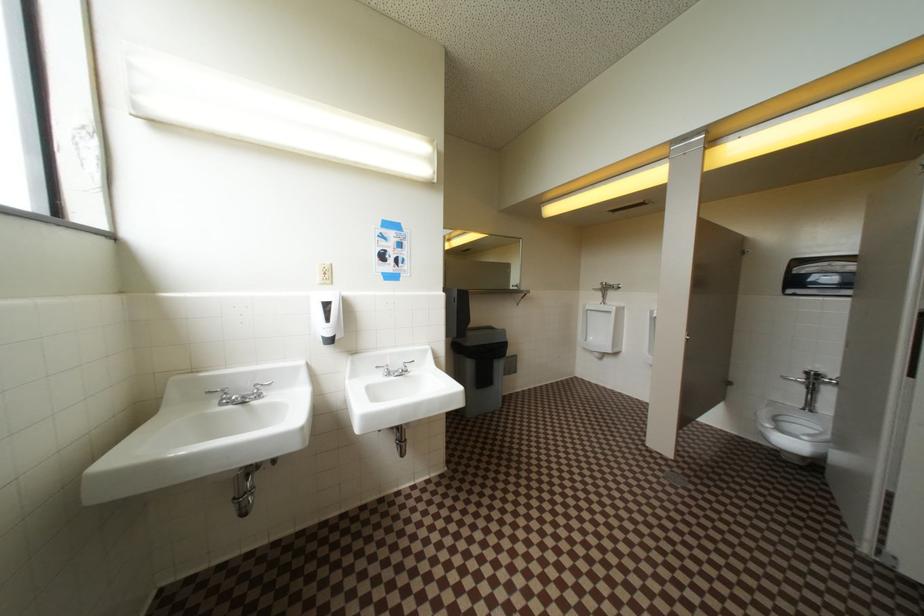
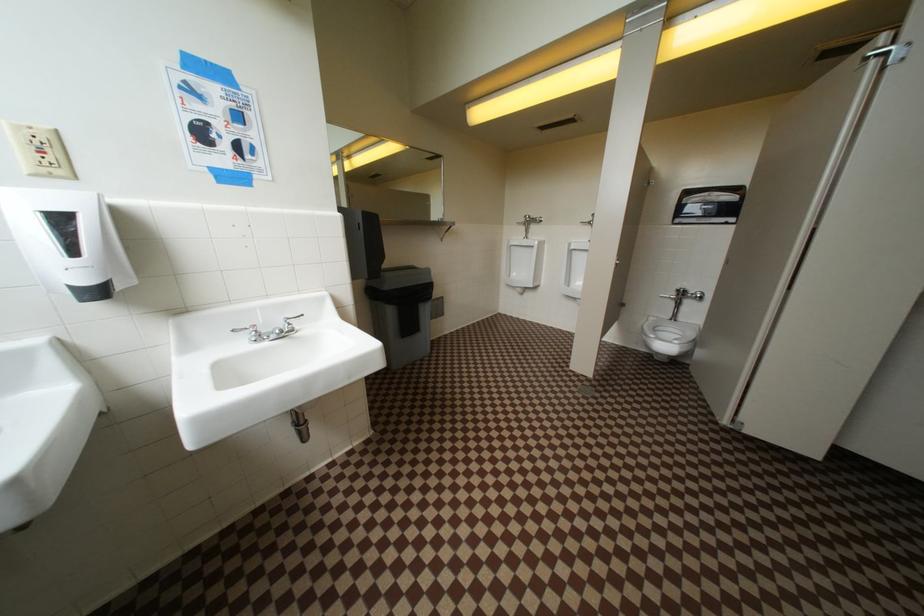
Question: The images are taken continuously from a first-person perspective. In which direction are you moving?

Choices:
 (A) Left
 (B) Right
 (C) Forward
 (D) Backward

Answer: (C)